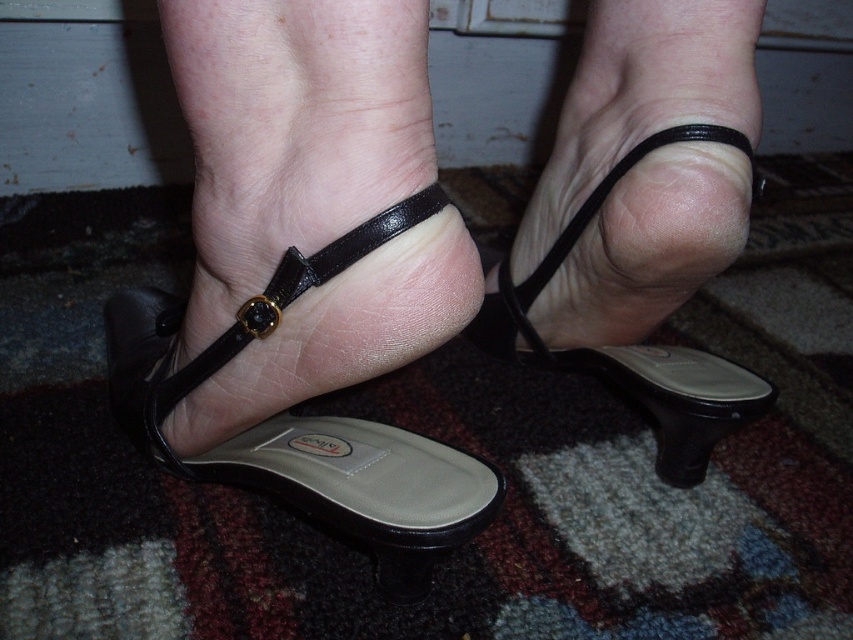
Question: Where is black leather sandal at center located in relation to black leather strap at center in the image?

Choices:
 (A) below
 (B) above

Answer: (A)

Question: Which object is farther from the camera taking this photo?

Choices:
 (A) black leather sandal at lower left
 (B) black leather strap at center

Answer: (A)

Question: Which point is closer to the camera?

Choices:
 (A) (454, 525)
 (B) (173, 378)

Answer: (A)

Question: Which point appears closest to the camera in this image?

Choices:
 (A) (697, 417)
 (B) (283, 268)
 (C) (352, 500)

Answer: (B)

Question: Considering the relative positions of black leather sandal at lower left and black leather sandal at center in the image provided, where is black leather sandal at lower left located with respect to black leather sandal at center?

Choices:
 (A) left
 (B) right

Answer: (A)

Question: Can you confirm if black leather sandal at lower left is positioned above black leather sandal at center?

Choices:
 (A) yes
 (B) no

Answer: (B)